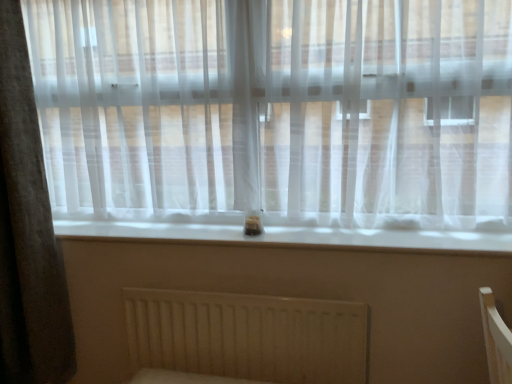
Locate an element on the screen. This screenshot has height=384, width=512. white matte radiator at lower center is located at coordinates (243, 338).

At what (x,y) coordinates should I click in order to perform the action: click on gray fabric curtain at left. Please return your answer as a coordinate pair (x, y). The image size is (512, 384). Looking at the image, I should click on (27, 230).

From the image's perspective, which one is positioned lower, white matte radiator at lower center or gray fabric curtain at left?

white matte radiator at lower center, from the image's perspective.

Which is more to the left, white matte radiator at lower center or gray fabric curtain at left?

Positioned to the left is gray fabric curtain at left.

Could you tell me if white matte radiator at lower center is turned towards gray fabric curtain at left?

No, white matte radiator at lower center does not turn towards gray fabric curtain at left.

Can you confirm if gray fabric curtain at left is thinner than white matte radiator at lower center?

In fact, gray fabric curtain at left might be wider than white matte radiator at lower center.

Is the position of gray fabric curtain at left more distant than that of white matte radiator at lower center?

No, it is not.

What's the angular difference between gray fabric curtain at left and white matte radiator at lower center's facing directions?

There is a 4.13-degree angle between the facing directions of gray fabric curtain at left and white matte radiator at lower center.

Is gray fabric curtain at left positioned with its back to white matte radiator at lower center?

No, white matte radiator at lower center is not at the back of gray fabric curtain at left.

Visually, is white matte radiator at lower center positioned to the left or to the right of white smooth window sill at center?

Based on their positions, white matte radiator at lower center is located to the left of white smooth window sill at center.

Which object is wider, white matte radiator at lower center or white smooth window sill at center?

white smooth window sill at center is wider.

Is white smooth window sill at center at the back of white matte radiator at lower center?

No.

Would you say white matte radiator at lower center is inside or outside white smooth window sill at center?

white matte radiator at lower center is outside white smooth window sill at center.

From the image's perspective, is gray fabric curtain at left above or below white smooth window sill at center?

Clearly, from the image's perspective, gray fabric curtain at left is above white smooth window sill at center.

Looking at their sizes, would you say gray fabric curtain at left is wider or thinner than white smooth window sill at center?

In the image, gray fabric curtain at left appears to be more narrow than white smooth window sill at center.

Can you confirm if gray fabric curtain at left is smaller than white smooth window sill at center?

No.

From a real-world perspective, which object rests below the other?

white smooth window sill at center is physically lower.

Does white smooth window sill at center appear on the left side of white matte radiator at lower center?

In fact, white smooth window sill at center is to the right of white matte radiator at lower center.

Are white smooth window sill at center and white matte radiator at lower center beside each other?

No.

Can you confirm if white smooth window sill at center is bigger than white matte radiator at lower center?

Actually, white smooth window sill at center might be smaller than white matte radiator at lower center.

Relative to white matte radiator at lower center, is white smooth window sill at center in front or behind?

Clearly, white smooth window sill at center is in front of white matte radiator at lower center.

Is white smooth window sill at center aimed at gray fabric curtain at left?

No, white smooth window sill at center is not facing towards gray fabric curtain at left.

From a real-world perspective, is white smooth window sill at center below gray fabric curtain at left?

Correct, in the physical world, white smooth window sill at center is lower than gray fabric curtain at left.

In the scene shown: Would you say white smooth window sill at center is a long distance from gray fabric curtain at left?

No.

Based on the photo, from the image's perspective, is white smooth window sill at center located beneath gray fabric curtain at left?

Indeed, from the image's perspective, white smooth window sill at center is shown beneath gray fabric curtain at left.

Locate an element on the screen. The height and width of the screenshot is (384, 512). curtain located on the left of white matte radiator at lower center is located at coordinates (27, 230).

This screenshot has width=512, height=384. In order to click on radiator below the gray fabric curtain at left (from a real-world perspective) in this screenshot , I will do `click(243, 338)`.

Looking at the image, which one is located closer to white smooth window sill at center, white matte radiator at lower center or gray fabric curtain at left?

Based on the image, white matte radiator at lower center appears to be nearer to white smooth window sill at center.

Looking at the image, which one is located closer to white matte radiator at lower center, white smooth window sill at center or gray fabric curtain at left?

white smooth window sill at center is positioned closer to the anchor white matte radiator at lower center.

Considering their positions, is white smooth window sill at center positioned further to gray fabric curtain at left than white matte radiator at lower center?

Among the two, white matte radiator at lower center is located further to gray fabric curtain at left.

When comparing their distances from white smooth window sill at center, does gray fabric curtain at left or white matte radiator at lower center seem further?

gray fabric curtain at left is positioned further to the anchor white smooth window sill at center.

From the image, which object appears to be nearer to gray fabric curtain at left, white matte radiator at lower center or white smooth window sill at center?

white smooth window sill at center is positioned closer to the anchor gray fabric curtain at left.

Estimate the real-world distances between objects in this image. Which object is closer to white matte radiator at lower center, gray fabric curtain at left or white smooth window sill at center?

Based on the image, white smooth window sill at center appears to be nearer to white matte radiator at lower center.

The height and width of the screenshot is (384, 512). What are the coordinates of `radiator between gray fabric curtain at left and white smooth window sill at center in the horizontal direction` in the screenshot? It's located at (243, 338).